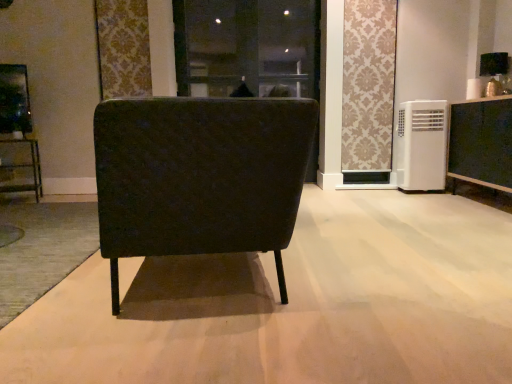
Question: Is matte black cabinet at right facing away from white plastic air conditioner at right?

Choices:
 (A) yes
 (B) no

Answer: (B)

Question: Considering the relative sizes of matte black cabinet at right and white plastic air conditioner at right in the image provided, is matte black cabinet at right smaller than white plastic air conditioner at right?

Choices:
 (A) yes
 (B) no

Answer: (B)

Question: From the image's perspective, is matte black cabinet at right under white plastic air conditioner at right?

Choices:
 (A) yes
 (B) no

Answer: (A)

Question: From a real-world perspective, is matte black cabinet at right physically below white plastic air conditioner at right?

Choices:
 (A) no
 (B) yes

Answer: (B)

Question: Is the position of matte black cabinet at right less distant than that of white plastic air conditioner at right?

Choices:
 (A) yes
 (B) no

Answer: (A)

Question: Is black fabric screen door at center in front of or behind matte black chair at center in the image?

Choices:
 (A) front
 (B) behind

Answer: (B)

Question: Based on their positions, is black fabric screen door at center located to the left or right of matte black chair at center?

Choices:
 (A) right
 (B) left

Answer: (A)

Question: Is black fabric screen door at center wider or thinner than matte black chair at center?

Choices:
 (A) wide
 (B) thin

Answer: (B)

Question: Is black fabric screen door at center bigger or smaller than matte black chair at center?

Choices:
 (A) small
 (B) big

Answer: (A)

Question: Considering the positions of matte black chair at center and black fabric screen door at center in the image, is matte black chair at center wider or thinner than black fabric screen door at center?

Choices:
 (A) wide
 (B) thin

Answer: (A)

Question: Choose the correct answer: Is matte black chair at center inside black fabric screen door at center or outside it?

Choices:
 (A) inside
 (B) outside

Answer: (B)

Question: From a real-world perspective, is matte black chair at center physically located above or below black fabric screen door at center?

Choices:
 (A) above
 (B) below

Answer: (B)

Question: From their relative heights in the image, would you say matte black chair at center is taller or shorter than black fabric screen door at center?

Choices:
 (A) tall
 (B) short

Answer: (B)

Question: Based on their positions, is matte black chair at center located to the left or right of patterned fabric curtain at upper center?

Choices:
 (A) left
 (B) right

Answer: (A)

Question: Which is correct: matte black chair at center is inside patterned fabric curtain at upper center, or outside of it?

Choices:
 (A) inside
 (B) outside

Answer: (B)